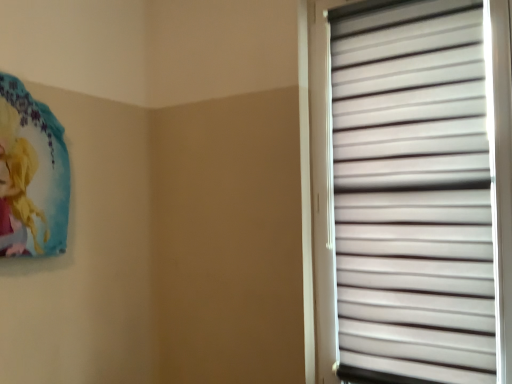
Question: Would you say white matte window blind at right is inside or outside matte blue poster at upper left?

Choices:
 (A) outside
 (B) inside

Answer: (A)

Question: From a real-world perspective, relative to matte blue poster at upper left, is white matte window blind at right vertically above or below?

Choices:
 (A) above
 (B) below

Answer: (B)

Question: Considering the positions of white matte window blind at right and matte blue poster at upper left in the image, is white matte window blind at right taller or shorter than matte blue poster at upper left?

Choices:
 (A) tall
 (B) short

Answer: (A)

Question: Is matte blue poster at upper left to the left or to the right of white matte window blind at right in the image?

Choices:
 (A) left
 (B) right

Answer: (A)

Question: From the image's perspective, is matte blue poster at upper left positioned above or below white matte window blind at right?

Choices:
 (A) below
 (B) above

Answer: (B)

Question: From a real-world perspective, is matte blue poster at upper left above or below white matte window blind at right?

Choices:
 (A) above
 (B) below

Answer: (A)

Question: Considering the positions of matte blue poster at upper left and white matte window blind at right in the image, is matte blue poster at upper left wider or thinner than white matte window blind at right?

Choices:
 (A) thin
 (B) wide

Answer: (B)